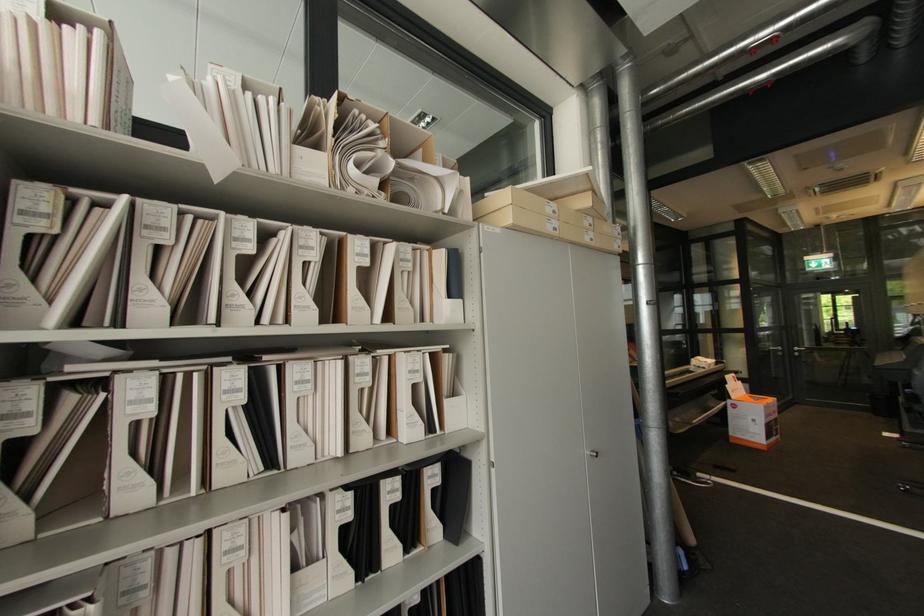
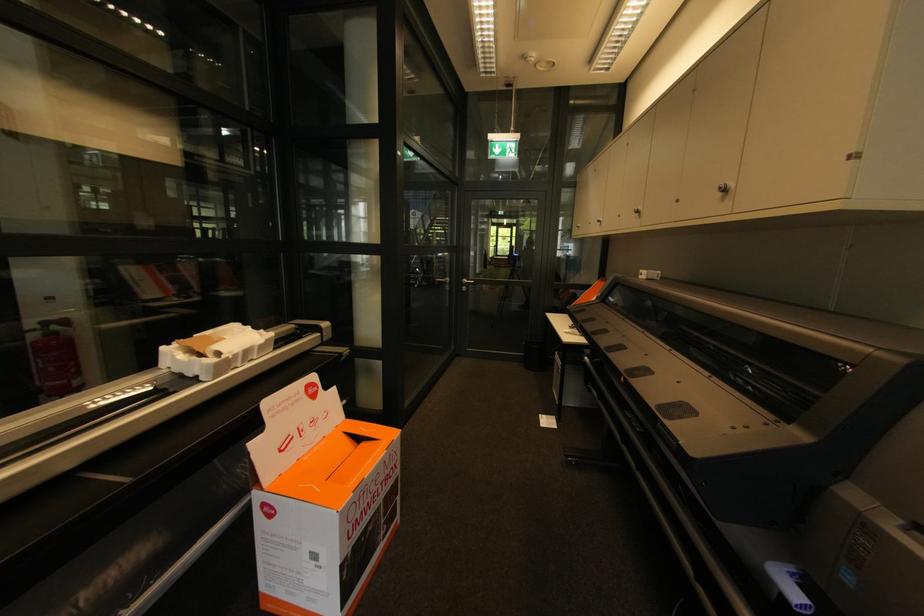
Question: I am providing you with two images of the same scene from different viewpoints. Please identify which objects are invisible in image2.

Choices:
 (A) silver cabinet knob
 (B) metal door handle
 (C) orange cardboard box
 (D) none of these

Answer: (D)